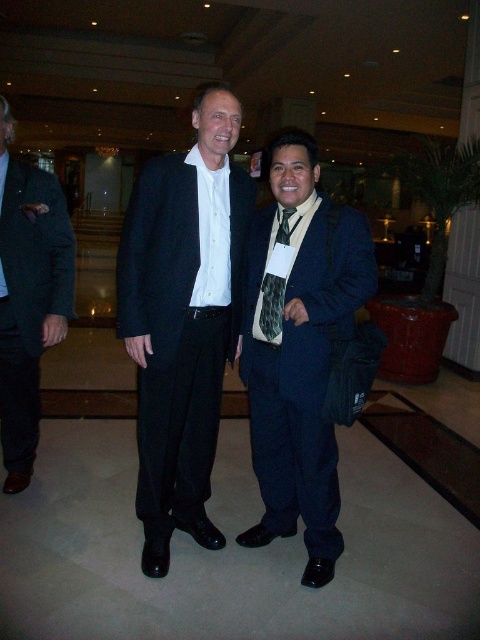
You are a photographer setting up for a group photo. You need to ensure that the matte black suit at center and the green textured tie at center are within a 15 inch frame. Based on their current positions, will they both fit within the frame?

The distance between the matte black suit at center and the green textured tie at center is 16.24 inches. Since the frame is only 15 inches wide, they will not both fit within the frame.

You are at an event and need to locate the speaker who is wearing the navy blue suit at center. Which direction should you look relative to the matte black suit at left?

The navy blue suit at center is to the right of the matte black suit at left, so you should look to the right of the matte black suit at left to find the speaker.

You are a photographer setting up for a group photo. You need to ensure that the matte black suit at center and the green textured tie at center are both clearly visible in the frame. Which object should you focus on to ensure proper focus, considering their sizes?

The matte black suit at center is wider than the green textured tie at center, so focusing on the matte black suit at center would ensure proper focus as it is larger and more prominent.